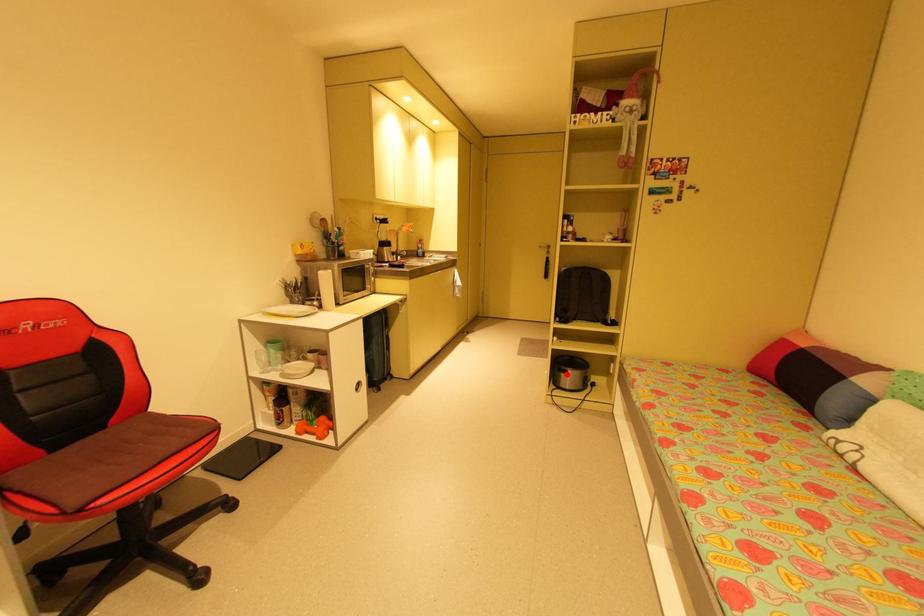
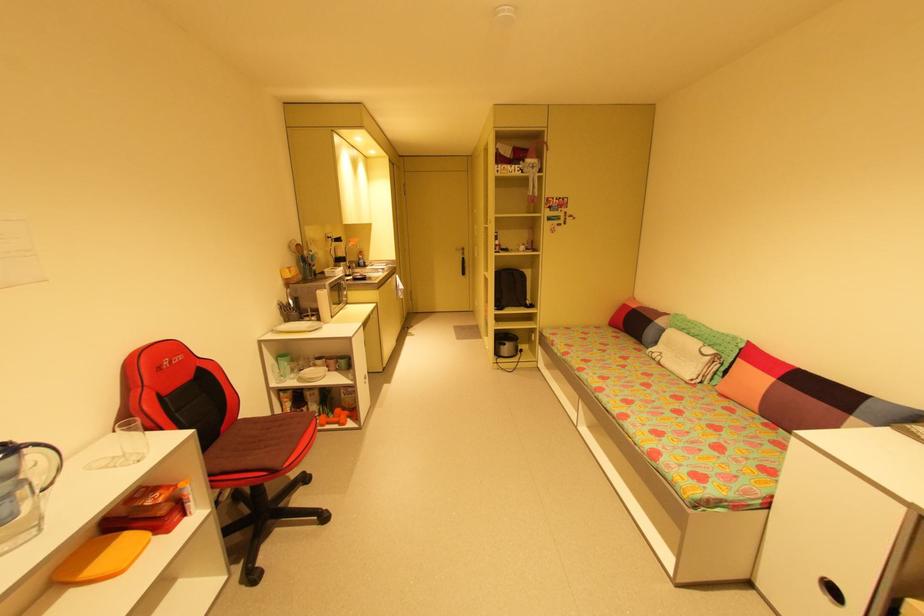
Find the pixel in the second image that matches the highlighted location in the first image.

(505, 347)